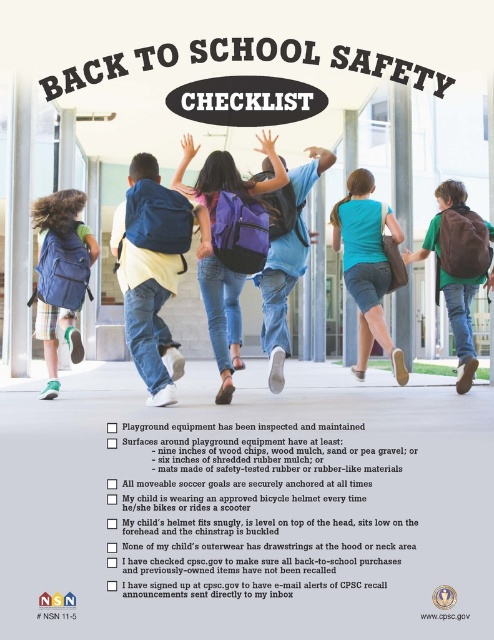
Question: Does teal fabric backpack at center have a larger size compared to matte blue backpack at center?

Choices:
 (A) no
 (B) yes

Answer: (A)

Question: Is the position of brown leather backpack at center more distant than that of matte blue backpack at center?

Choices:
 (A) no
 (B) yes

Answer: (B)

Question: Is teal fabric backpack at center positioned in front of matte blue backpack at left?

Choices:
 (A) no
 (B) yes

Answer: (A)

Question: Considering the real-world distances, which object is closest to the matte blue backpack at center?

Choices:
 (A) matte purple backpack at center
 (B) teal fabric backpack at center
 (C) matte blue backpack at left
 (D) brown leather backpack at center

Answer: (A)

Question: Among these points, which one is nearest to the camera?

Choices:
 (A) tap(309, 179)
 (B) tap(47, 340)

Answer: (A)

Question: Which of the following is the farthest from the observer?

Choices:
 (A) (376, 228)
 (B) (273, 326)
 (C) (457, 320)
 (D) (43, 305)

Answer: (C)